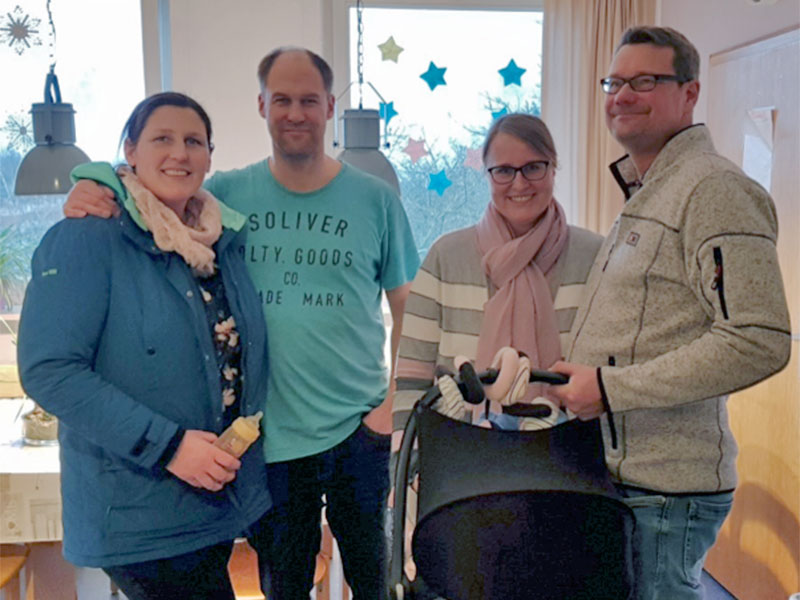
The width and height of the screenshot is (800, 600). What are the coordinates of `pink star cutout on window` in the screenshot? It's located at (413, 146), (468, 157).